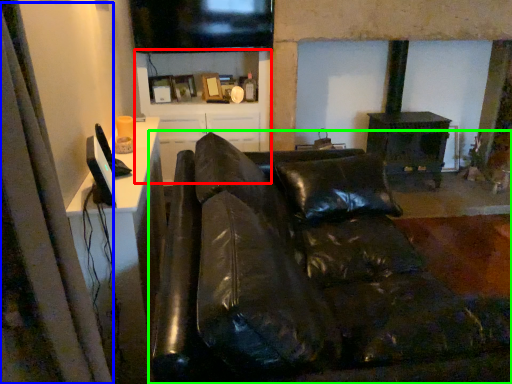
Question: Which object is the farthest from tv cabinet (highlighted by a red box)? Choose among these: curtain (highlighted by a blue box) or studio couch (highlighted by a green box).

Choices:
 (A) curtain
 (B) studio couch

Answer: (A)